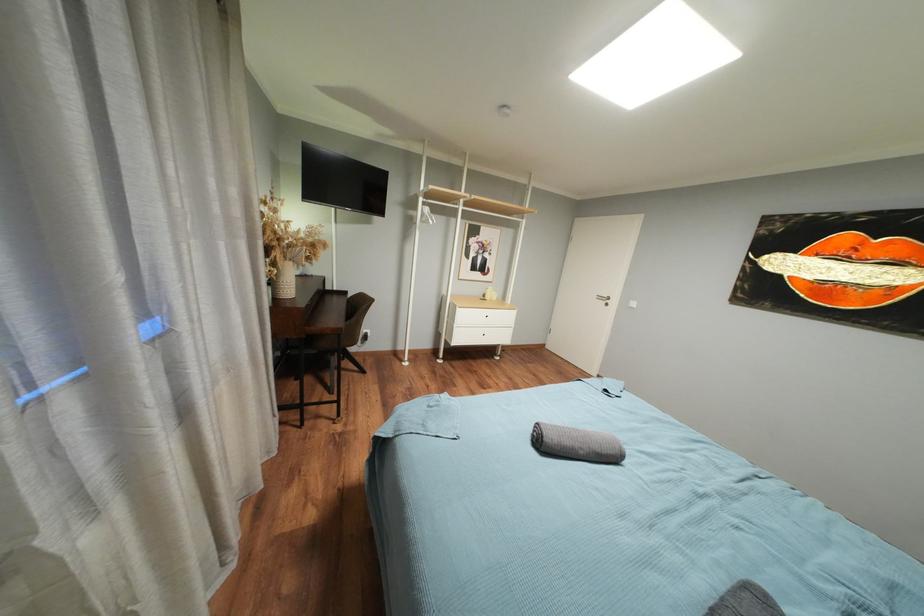
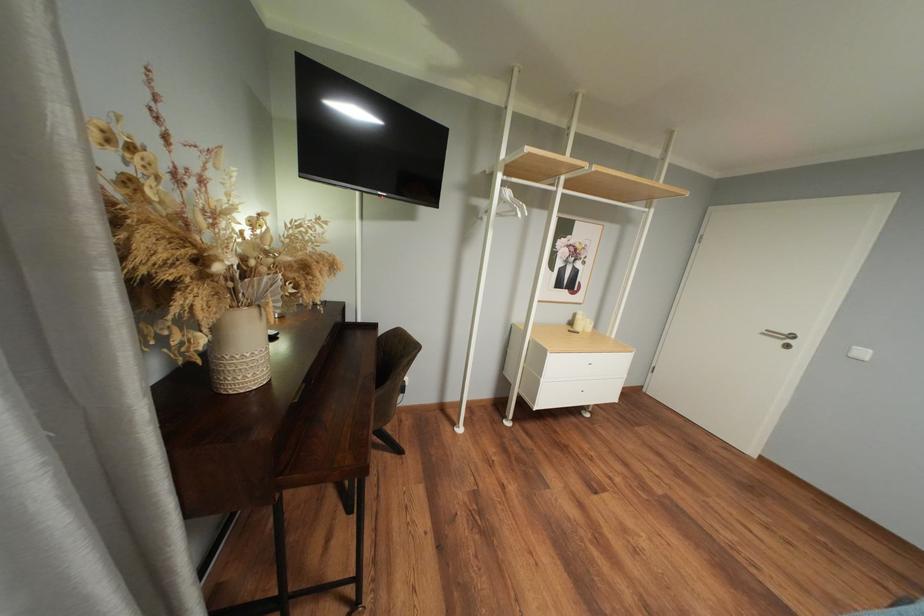
The images are taken continuously from a first-person perspective. In which direction are you moving?

The cameraman moved toward left, forward.